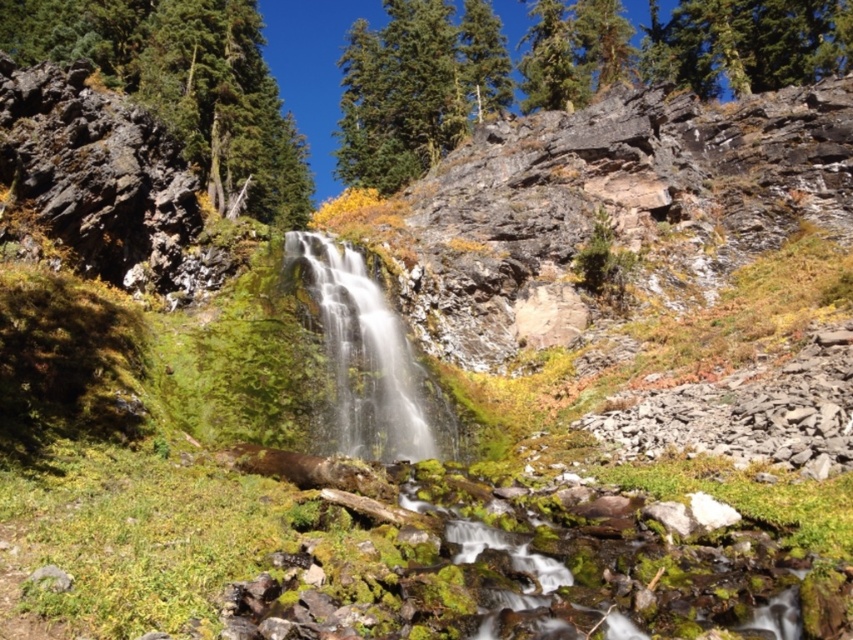
Does green rough bark tree at upper center have a lesser height compared to white frothy water at center?

In fact, green rough bark tree at upper center may be taller than white frothy water at center.

The width and height of the screenshot is (853, 640). What are the coordinates of `green rough bark tree at upper center` in the screenshot? It's located at (683, 45).

Who is higher up, green rough bark tree at upper left or white frothy water at center?

green rough bark tree at upper left

Is point (108, 17) in front of point (416, 433)?

That is False.

Identify the location of green rough bark tree at upper left. Image resolution: width=853 pixels, height=640 pixels. (184, 84).

Is green rough bark tree at upper center smaller than green rough bark tree at upper left?

No.

Is green rough bark tree at upper center shorter than green rough bark tree at upper left?

In fact, green rough bark tree at upper center may be taller than green rough bark tree at upper left.

Between point (579, 90) and point (109, 58), which one is positioned behind?

Point (579, 90)

You are a GUI agent. You are given a task and a screenshot of the screen. Output one action in this format:
    pyautogui.click(x=<x>, y=<y>)
    Task: Click on the green rough bark tree at upper center
    The height and width of the screenshot is (640, 853).
    Given the screenshot: What is the action you would take?
    pyautogui.click(x=683, y=45)